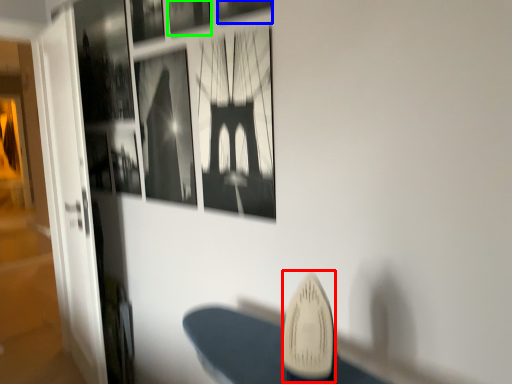
Question: Estimate the real-world distances between objects in this image. Which object is closer to surfboard (highlighted by a red box), picture frame (highlighted by a blue box) or picture frame (highlighted by a green box)?

Choices:
 (A) picture frame
 (B) picture frame

Answer: (A)